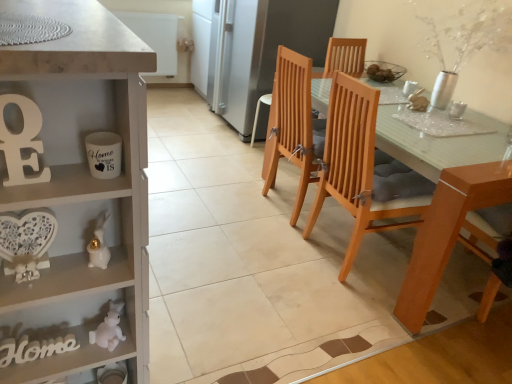
Question: Should I look upward or downward to see wooden chair at right, positioned as the 3th chair in left-to-right order?

Choices:
 (A) up
 (B) down

Answer: (B)

Question: From a real-world perspective, is wooden chair at right, positioned as the 3th chair in left-to-right order, below white glossy coffee cup at upper right, arranged as the 2th coffee cup when viewed from the left?

Choices:
 (A) yes
 (B) no

Answer: (A)

Question: Does wooden chair at right, placed as the 1th chair when sorted from right to left, contain white glossy coffee cup at upper right, which is counted as the third coffee cup, starting from the front?

Choices:
 (A) yes
 (B) no

Answer: (B)

Question: From the image's perspective, is wooden chair at right, positioned as the 3th chair in left-to-right order, on white glossy coffee cup at upper right, which appears as the 3th coffee cup when ordered from the bottom?

Choices:
 (A) yes
 (B) no

Answer: (B)

Question: Is wooden chair at right, placed as the 1th chair when sorted from right to left, touching white glossy coffee cup at upper right, which is counted as the third coffee cup, starting from the front?

Choices:
 (A) no
 (B) yes

Answer: (A)

Question: From a real-world perspective, is wooden chair at right, positioned as the 3th chair in left-to-right order, positioned over white glossy coffee cup at upper right, the second coffee cup viewed from the right, based on gravity?

Choices:
 (A) no
 (B) yes

Answer: (A)

Question: Is wooden chair at right, placed as the 1th chair when sorted from right to left, located outside white glossy coffee cup at upper right, the 1th coffee cup viewed from the back?

Choices:
 (A) yes
 (B) no

Answer: (A)

Question: Is white glossy rabbit at lower left, the 2th toy viewed from the back, smaller than white glossy coffee cup at upper right, the 1th coffee cup viewed from the back?

Choices:
 (A) no
 (B) yes

Answer: (A)

Question: Considering the relative positions of white glossy rabbit at lower left, the 1th toy from the top, and white glossy coffee cup at upper right, arranged as the 2th coffee cup when viewed from the left, in the image provided, is white glossy rabbit at lower left, the 1th toy from the top, to the right of white glossy coffee cup at upper right, arranged as the 2th coffee cup when viewed from the left, from the viewer's perspective?

Choices:
 (A) yes
 (B) no

Answer: (B)

Question: Is white glossy rabbit at lower left, which appears as the 2th toy when ordered from the bottom, with white glossy coffee cup at upper right, which is counted as the third coffee cup, starting from the front?

Choices:
 (A) yes
 (B) no

Answer: (B)

Question: Can you confirm if white glossy rabbit at lower left, the 1th toy from the top, is shorter than white glossy coffee cup at upper right, arranged as the 2th coffee cup when viewed from the left?

Choices:
 (A) no
 (B) yes

Answer: (A)

Question: Does white glossy rabbit at lower left, the 1th toy from the top, contain white glossy coffee cup at upper right, marked as the first coffee cup in a top-to-bottom arrangement?

Choices:
 (A) no
 (B) yes

Answer: (A)

Question: Are white glossy rabbit at lower left, the 1th toy from the top, and white glossy coffee cup at upper right, arranged as the 2th coffee cup when viewed from the left, far apart?

Choices:
 (A) yes
 (B) no

Answer: (A)

Question: From a real-world perspective, is light brown wood chair at center, the 3th chair in the right-to-left sequence, over satin silver refrigerator at center?

Choices:
 (A) yes
 (B) no

Answer: (B)